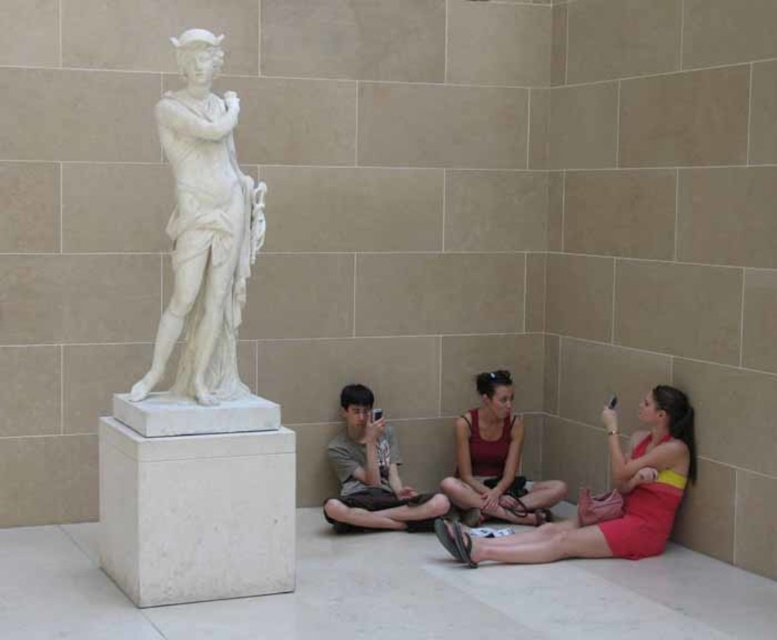
Question: Is white marble statue at left below matte red dress at lower right?

Choices:
 (A) yes
 (B) no

Answer: (B)

Question: Does white marble statue at center come in front of matte red tank top at lower center?

Choices:
 (A) no
 (B) yes

Answer: (B)

Question: Among these points, which one is farthest from the camera?

Choices:
 (A) (227, 330)
 (B) (150, 460)
 (C) (518, 506)

Answer: (C)

Question: Is white marble pedestal at center smaller than matte red tank top at lower center?

Choices:
 (A) yes
 (B) no

Answer: (B)

Question: Which of the following is the closest to the observer?

Choices:
 (A) white marble pedestal at center
 (B) gray cotton t-shirt at center
 (C) white marble statue at left

Answer: (A)

Question: Which of the following is the closest to the observer?

Choices:
 (A) matte red tank top at lower center
 (B) white marble statue at left

Answer: (B)